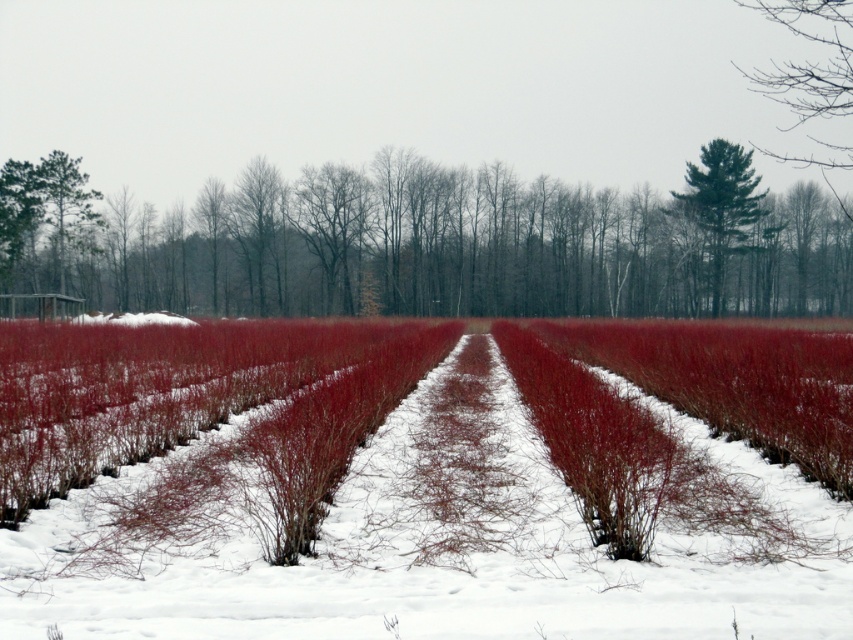
Which is more to the right, smooth bark tree at left or green textured pine tree at upper center?

From the viewer's perspective, green textured pine tree at upper center appears more on the right side.

Find the location of a particular element. The image size is (853, 640). smooth bark tree at left is located at coordinates (425, 244).

Locate an element on the screen. smooth bark tree at left is located at coordinates (425, 244).